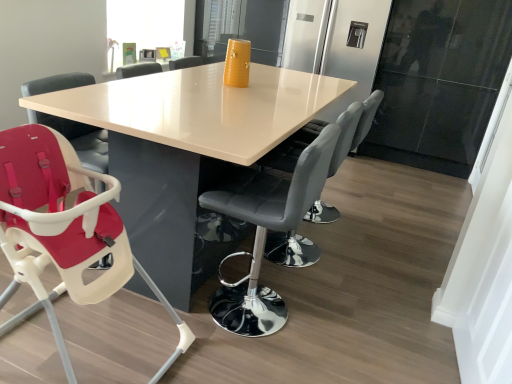
What do you see at coordinates (186, 146) in the screenshot? I see `white glossy table at center` at bounding box center [186, 146].

Where is `transparent glass window screen at upper left`? This screenshot has width=512, height=384. transparent glass window screen at upper left is located at coordinates (149, 24).

Locate an element on the screen. This screenshot has width=512, height=384. white glossy table at center is located at coordinates (186, 146).

Can you confirm if matte white highchair at lower left, positioned as the third chair in right-to-left order, is wider than matte black chair at center, placed as the third chair when sorted from left to right?

Correct, the width of matte white highchair at lower left, positioned as the third chair in right-to-left order, exceeds that of matte black chair at center, placed as the third chair when sorted from left to right.

Considering the positions of point (28, 234) and point (318, 126), is point (28, 234) closer or farther from the camera than point (318, 126)?

Point (28, 234).

Who is bigger, matte white highchair at lower left, positioned as the third chair in right-to-left order, or matte black chair at center, placed as the third chair when sorted from left to right?

Bigger between the two is matte white highchair at lower left, positioned as the third chair in right-to-left order.

Which of these two, matte white highchair at lower left, positioned as the 1th chair in left-to-right order, or matte black chair at center, which is counted as the 1th chair, starting from the right, stands shorter?

With less height is matte white highchair at lower left, positioned as the 1th chair in left-to-right order.

Does matte white highchair at lower left, positioned as the 1th chair in left-to-right order, have a lesser height compared to transparent glass window screen at upper left?

In fact, matte white highchair at lower left, positioned as the 1th chair in left-to-right order, may be taller than transparent glass window screen at upper left.

Does matte white highchair at lower left, positioned as the 1th chair in left-to-right order, have a smaller size compared to transparent glass window screen at upper left?

No.

Is there a large distance between matte white highchair at lower left, positioned as the 1th chair in left-to-right order, and transparent glass window screen at upper left?

Yes, matte white highchair at lower left, positioned as the 1th chair in left-to-right order, is far from transparent glass window screen at upper left.

Is matte white highchair at lower left, positioned as the third chair in right-to-left order, behind transparent glass window screen at upper left?

That is False.

Is black leather bar stool at center, which is the second chair in left-to-right order, aimed at matte white highchair at lower left, positioned as the 1th chair in left-to-right order?

No.

From the image's perspective, between black leather bar stool at center, which is the second chair in left-to-right order, and matte white highchair at lower left, positioned as the third chair in right-to-left order, who is located below?

matte white highchair at lower left, positioned as the third chair in right-to-left order.

Considering the relative sizes of black leather bar stool at center, which is the second chair in left-to-right order, and matte white highchair at lower left, positioned as the third chair in right-to-left order, in the image provided, is black leather bar stool at center, which is the second chair in left-to-right order, bigger than matte white highchair at lower left, positioned as the third chair in right-to-left order,?

Actually, black leather bar stool at center, which is the second chair in left-to-right order, might be smaller than matte white highchair at lower left, positioned as the third chair in right-to-left order.

Is transparent glass window screen at upper left facing towards matte black chair at center, which is counted as the 1th chair, starting from the right?

Yes, transparent glass window screen at upper left is aimed at matte black chair at center, which is counted as the 1th chair, starting from the right.

How different are the orientations of transparent glass window screen at upper left and matte black chair at center, which is counted as the 1th chair, starting from the right, in degrees?

The angular difference between transparent glass window screen at upper left and matte black chair at center, which is counted as the 1th chair, starting from the right, is 178 degrees.

Is transparent glass window screen at upper left spatially inside matte black chair at center, which is counted as the 1th chair, starting from the right, or outside of it?

transparent glass window screen at upper left is spatially situated outside matte black chair at center, which is counted as the 1th chair, starting from the right.

What are the coordinates of `window screen above the matte black chair at center, which is counted as the 1th chair, starting from the right (from a real-world perspective)` in the screenshot? It's located at (149, 24).

Measure the distance between white glossy table at center and matte black chair at center, which is counted as the 1th chair, starting from the right.

white glossy table at center and matte black chair at center, which is counted as the 1th chair, starting from the right, are 17.82 inches apart.

From the white glossy table at center, count 2nd chair to the right and point to it. Please provide its 2D coordinates.

[(354, 128)]

From the image's perspective, who appears lower, white glossy table at center or matte black chair at center, placed as the third chair when sorted from left to right?

matte black chair at center, placed as the third chair when sorted from left to right.

Considering the points (160, 281) and (295, 146), which point is in front, point (160, 281) or point (295, 146)?

The point (160, 281) is closer.

Can white glossy table at center be found inside black leather bar stool at center, the 2th chair viewed from the right?

Definitely not — white glossy table at center is not inside black leather bar stool at center, the 2th chair viewed from the right.

Considering the sizes of black leather bar stool at center, which is the second chair in left-to-right order, and white glossy table at center in the image, is black leather bar stool at center, which is the second chair in left-to-right order, taller or shorter than white glossy table at center?

In the image, black leather bar stool at center, which is the second chair in left-to-right order, appears to be taller than white glossy table at center.

Which is behind, black leather bar stool at center, which is the second chair in left-to-right order, or white glossy table at center?

black leather bar stool at center, which is the second chair in left-to-right order, is more distant.

From the image's perspective, would you say black leather bar stool at center, which is the second chair in left-to-right order, is shown under white glossy table at center?

Yes.

From a real-world perspective, which object rests below the other?

matte white highchair at lower left, positioned as the 1th chair in left-to-right order.

Would you say matte white highchair at lower left, positioned as the third chair in right-to-left order, contains black leather bar stool at center, which is the second chair in left-to-right order?

No, black leather bar stool at center, which is the second chair in left-to-right order, is not surrounded by matte white highchair at lower left, positioned as the third chair in right-to-left order.

Is matte white highchair at lower left, positioned as the 1th chair in left-to-right order, oriented away from black leather bar stool at center, which is the second chair in left-to-right order?

No, black leather bar stool at center, which is the second chair in left-to-right order, is not at the back of matte white highchair at lower left, positioned as the 1th chair in left-to-right order.

In the image, is matte white highchair at lower left, positioned as the 1th chair in left-to-right order, positioned in front of or behind black leather bar stool at center, the 2th chair viewed from the right?

matte white highchair at lower left, positioned as the 1th chair in left-to-right order, is in front of black leather bar stool at center, the 2th chair viewed from the right.

Image resolution: width=512 pixels, height=384 pixels. I want to click on the 2nd chair in front of the matte black chair at center, which is counted as the 1th chair, starting from the right, so click(63, 230).

From the image's perspective, which chair is the 3rd one below the transparent glass window screen at upper left? Please provide its 2D coordinates.

[(63, 230)]

Based on their spatial positions, is matte white highchair at lower left, positioned as the 1th chair in left-to-right order, or matte black chair at center, which is counted as the 1th chair, starting from the right, further from transparent glass window screen at upper left?

Based on the image, matte white highchair at lower left, positioned as the 1th chair in left-to-right order, appears to be further to transparent glass window screen at upper left.

Which object lies nearer to the anchor point transparent glass window screen at upper left, matte white highchair at lower left, positioned as the third chair in right-to-left order, or black leather bar stool at center, the 2th chair viewed from the right?

matte white highchair at lower left, positioned as the third chair in right-to-left order, lies closer to transparent glass window screen at upper left than the other object.

Estimate the real-world distances between objects in this image. Which object is closer to transparent glass window screen at upper left, black leather bar stool at center, which is the second chair in left-to-right order, or matte white highchair at lower left, positioned as the third chair in right-to-left order?

The object closer to transparent glass window screen at upper left is matte white highchair at lower left, positioned as the third chair in right-to-left order.

Which object lies further to the anchor point matte white highchair at lower left, positioned as the third chair in right-to-left order, black leather bar stool at center, which is the second chair in left-to-right order, or matte black chair at center, which is counted as the 1th chair, starting from the right?

matte black chair at center, which is counted as the 1th chair, starting from the right, is further to matte white highchair at lower left, positioned as the third chair in right-to-left order.

From the image, which object appears to be nearer to white glossy table at center, transparent glass window screen at upper left or black leather bar stool at center, the 2th chair viewed from the right?

Based on the image, black leather bar stool at center, the 2th chair viewed from the right, appears to be nearer to white glossy table at center.

Estimate the real-world distances between objects in this image. Which object is further from matte white highchair at lower left, positioned as the third chair in right-to-left order, transparent glass window screen at upper left or matte black chair at center, placed as the third chair when sorted from left to right?

transparent glass window screen at upper left lies further to matte white highchair at lower left, positioned as the third chair in right-to-left order, than the other object.

Considering their positions, is matte black chair at center, which is counted as the 1th chair, starting from the right, positioned closer to black leather bar stool at center, the 2th chair viewed from the right, than matte white highchair at lower left, positioned as the third chair in right-to-left order?

matte black chair at center, which is counted as the 1th chair, starting from the right, is closer to black leather bar stool at center, the 2th chair viewed from the right.

From the image, which object appears to be nearer to black leather bar stool at center, which is the second chair in left-to-right order, white glossy table at center or matte white highchair at lower left, positioned as the third chair in right-to-left order?

white glossy table at center is positioned closer to the anchor black leather bar stool at center, which is the second chair in left-to-right order.

Find the location of a particular element. chair located between matte white highchair at lower left, positioned as the third chair in right-to-left order, and matte black chair at center, placed as the third chair when sorted from left to right, in the depth direction is located at coordinates (266, 235).

In order to click on chair between white glossy table at center and matte black chair at center, which is counted as the 1th chair, starting from the right, from front to back in this screenshot , I will do `click(266, 235)`.

Where is `chair located between black leather bar stool at center, which is the second chair in left-to-right order, and transparent glass window screen at upper left in the depth direction`? The height and width of the screenshot is (384, 512). chair located between black leather bar stool at center, which is the second chair in left-to-right order, and transparent glass window screen at upper left in the depth direction is located at coordinates (354, 128).

Where is `table between matte white highchair at lower left, positioned as the 1th chair in left-to-right order, and black leather bar stool at center, the 2th chair viewed from the right`? This screenshot has width=512, height=384. table between matte white highchair at lower left, positioned as the 1th chair in left-to-right order, and black leather bar stool at center, the 2th chair viewed from the right is located at coordinates (186, 146).